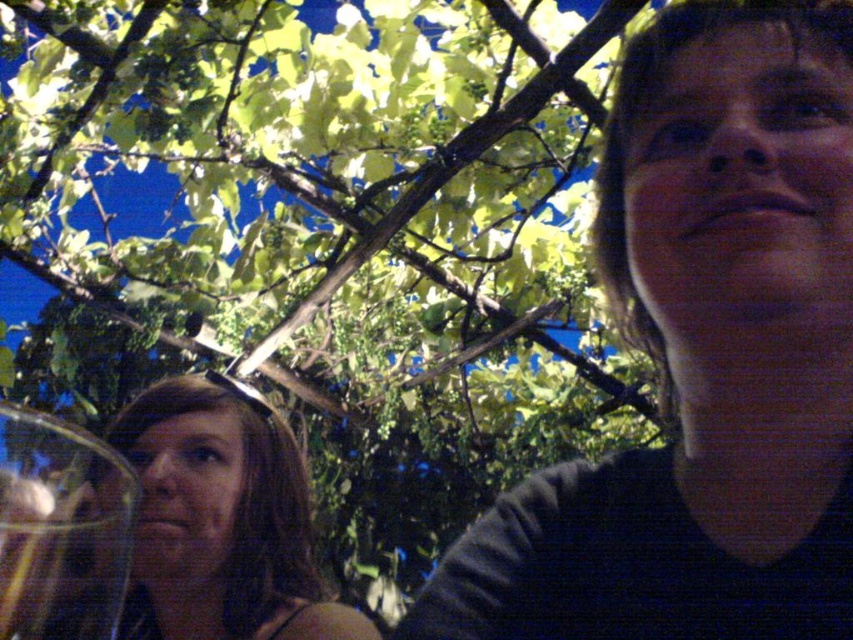
Question: Does matte brown hair at center have a lesser width compared to transparent glass at left?

Choices:
 (A) no
 (B) yes

Answer: (A)

Question: Which point appears farthest from the camera in this image?

Choices:
 (A) (306, 627)
 (B) (12, 557)
 (C) (625, 138)

Answer: (A)

Question: Can you confirm if matte brown hair at center is positioned to the left of transparent glass at left?

Choices:
 (A) no
 (B) yes

Answer: (B)

Question: Among these points, which one is nearest to the camera?

Choices:
 (A) (16, 500)
 (B) (184, 595)
 (C) (744, 573)

Answer: (A)

Question: Based on their relative distances, which object is farther from the transparent glass at left?

Choices:
 (A) dark gray sweater at upper right
 (B) matte brown hair at center

Answer: (B)

Question: Is matte brown hair at center behind transparent glass at left?

Choices:
 (A) yes
 (B) no

Answer: (A)